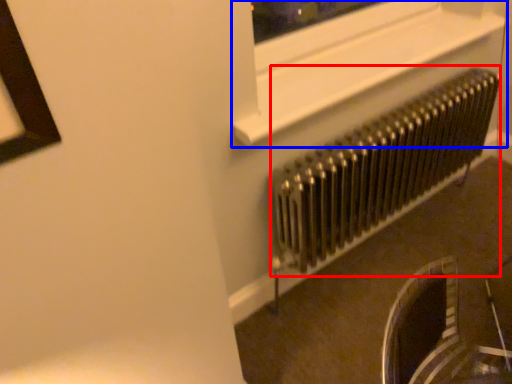
Question: Which object appears farthest to the camera in this image, radiator (highlighted by a red box) or window frame (highlighted by a blue box)?

Choices:
 (A) radiator
 (B) window frame

Answer: (A)